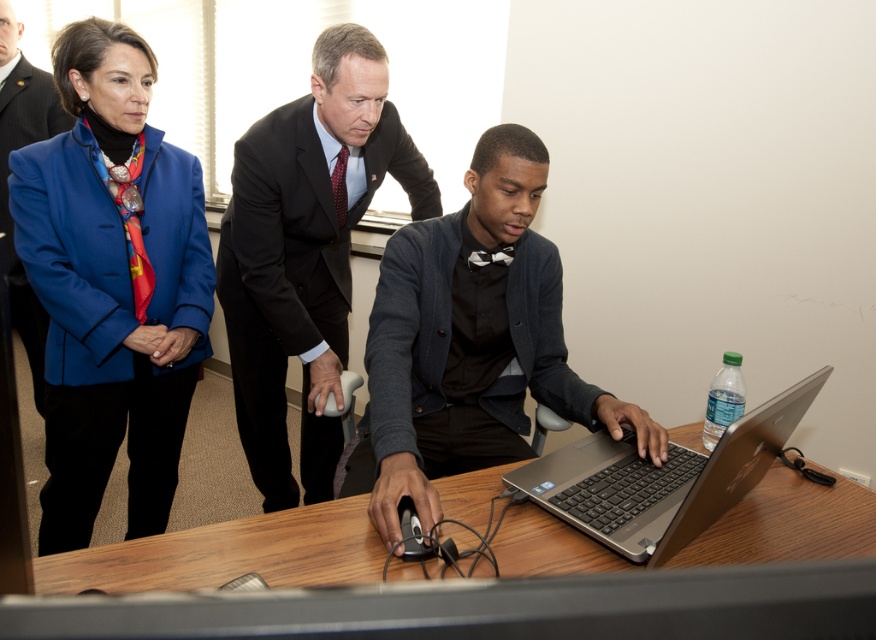
Who is higher up, blue fabric jacket at upper left or silver metallic laptop at center?

Positioned higher is blue fabric jacket at upper left.

Where is `blue fabric jacket at upper left`? Image resolution: width=876 pixels, height=640 pixels. blue fabric jacket at upper left is located at coordinates (111, 284).

Is black smooth suit at center wider than matte blue blazer at upper left?

Indeed, black smooth suit at center has a greater width compared to matte blue blazer at upper left.

Looking at this image, between black smooth suit at center and matte blue blazer at upper left, which one has more height?

matte blue blazer at upper left is taller.

I want to click on black smooth suit at center, so click(294, 266).

Is dark gray wool blazer at center below matte blue blazer at upper left?

Correct, dark gray wool blazer at center is located below matte blue blazer at upper left.

Between dark gray wool blazer at center and matte blue blazer at upper left, which one is positioned lower?

Positioned lower is dark gray wool blazer at center.

You are a GUI agent. You are given a task and a screenshot of the screen. Output one action in this format:
    pyautogui.click(x=<x>, y=<y>)
    Task: Click on the dark gray wool blazer at center
    
    Given the screenshot: What is the action you would take?
    pyautogui.click(x=461, y=353)